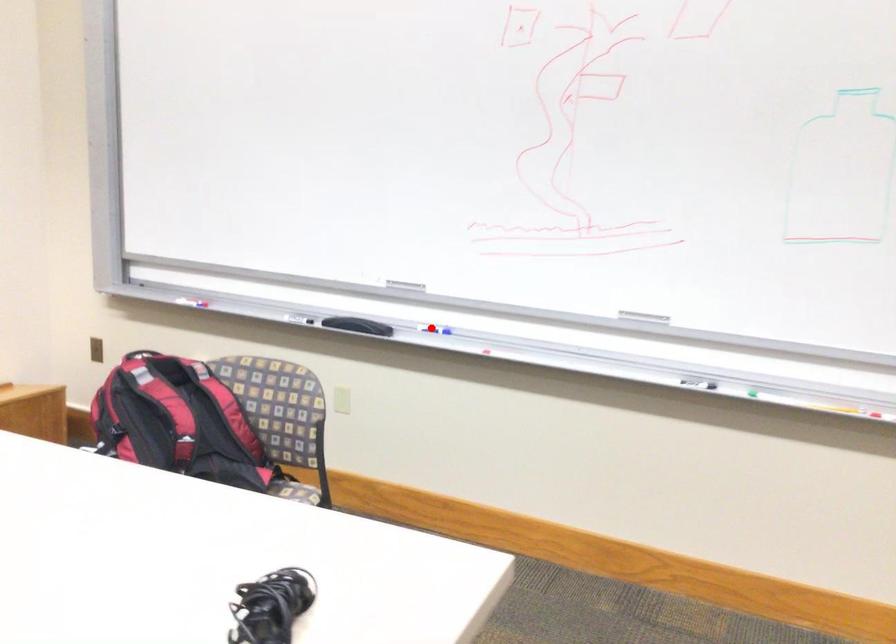
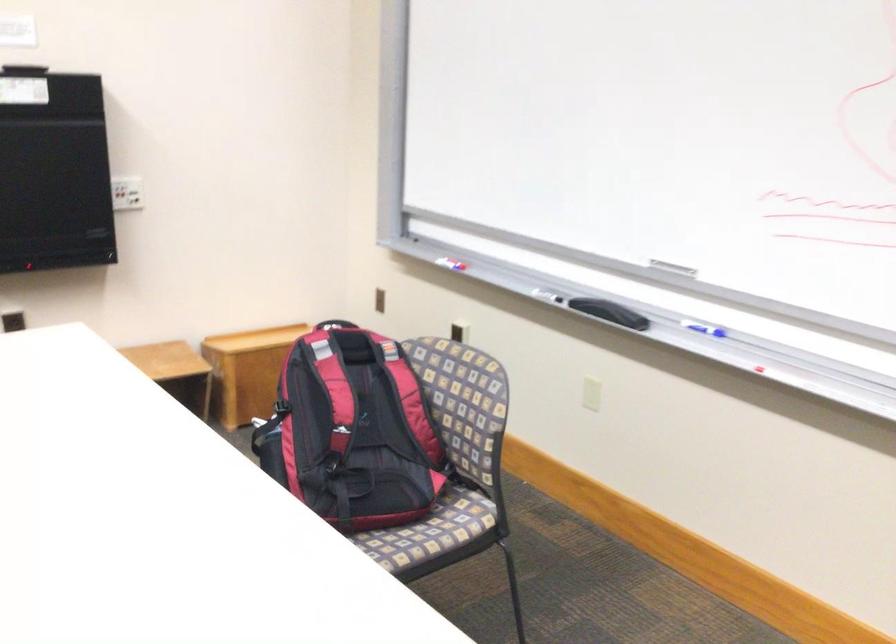
Question: I am providing you with two images of the same scene from different viewpoints. Image1 has a red point marked. In image2, the corresponding 3D location appears at what relative position? Reply with the corresponding letter.

Choices:
 (A) Closer
 (B) Farther

Answer: (A)